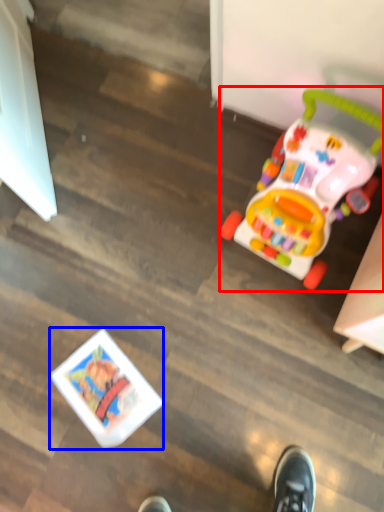
Question: Which of the following is the farthest to the observer, toy (highlighted by a red box) or toy (highlighted by a blue box)?

Choices:
 (A) toy
 (B) toy

Answer: (B)